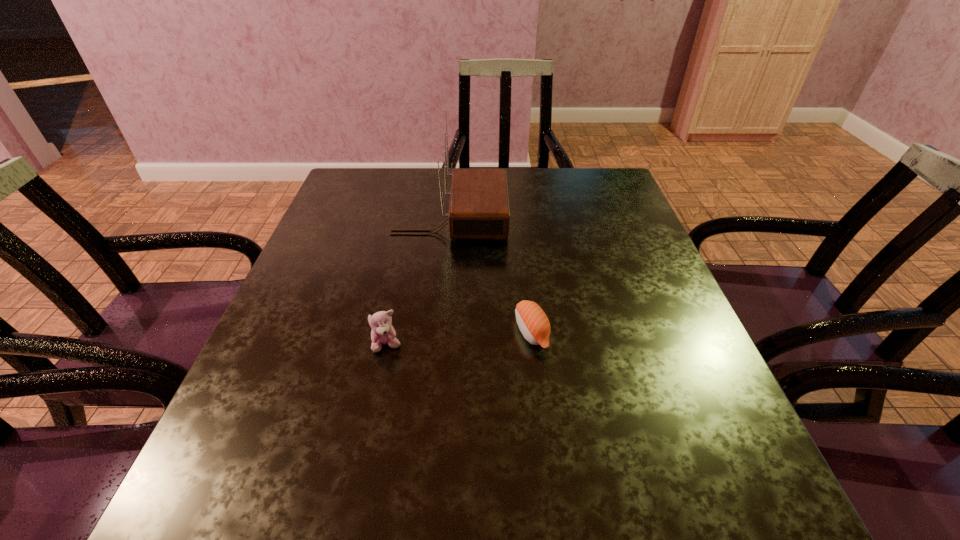
At what (x,y) coordinates should I click in order to perform the action: click on free space between the farthest object and the teddy bear. Please return your answer as a coordinate pair (x, y). The width and height of the screenshot is (960, 540). Looking at the image, I should click on (419, 282).

At what (x,y) coordinates should I click in order to perform the action: click on vacant space that is in between the tallest object and the teddy bear. Please return your answer as a coordinate pair (x, y). This screenshot has width=960, height=540. Looking at the image, I should click on (419, 282).

Where is `unoccupied area between the teddy bear and the farthest object`? Image resolution: width=960 pixels, height=540 pixels. unoccupied area between the teddy bear and the farthest object is located at coordinates (419, 282).

Where is `free spot between the teddy bear and the radio_receiver`? The width and height of the screenshot is (960, 540). free spot between the teddy bear and the radio_receiver is located at coordinates (419, 282).

The width and height of the screenshot is (960, 540). Identify the location of free space between the tallest object and the second tallest object. (419, 282).

Locate an element on the screen. The height and width of the screenshot is (540, 960). the second closest object relative to the tallest object is located at coordinates (382, 332).

Locate which object is the second closest to the shortest object. Please provide its 2D coordinates. Your answer should be formatted as a tuple, i.e. [(x, y)], where the tuple contains the x and y coordinates of a point satisfying the conditions above.

[(382, 332)]

This screenshot has width=960, height=540. Identify the location of free space that satisfies the following two spatial constraints: 1. on the back side of the sushi; 2. on the front panel of the radio_receiver. (518, 218).

The height and width of the screenshot is (540, 960). Identify the location of free space that satisfies the following two spatial constraints: 1. on the front panel of the tallest object; 2. at the face of the second tallest object. (439, 345).

You are a GUI agent. You are given a task and a screenshot of the screen. Output one action in this format:
    pyautogui.click(x=<x>, y=<y>)
    Task: Click on the free spot that satisfies the following two spatial constraints: 1. on the front panel of the radio_receiver; 2. at the face of the teddy bear
    The height and width of the screenshot is (540, 960).
    Given the screenshot: What is the action you would take?
    pyautogui.click(x=439, y=345)